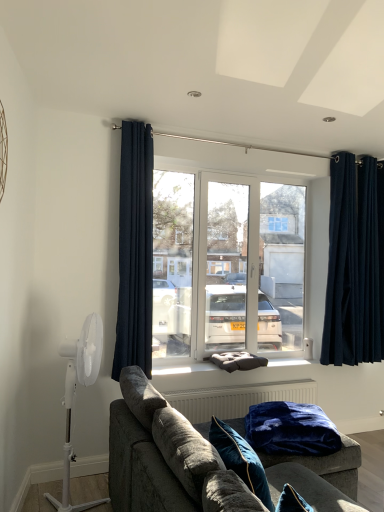
At what (x,y) coordinates should I click in order to perform the action: click on empty space that is ontop of dark blue textured curtain at center, which appears as the 2th curtain when viewed from the back (from a real-world perspective). Please return your answer as a coordinate pair (x, y). This screenshot has height=512, width=384. Looking at the image, I should click on (139, 114).